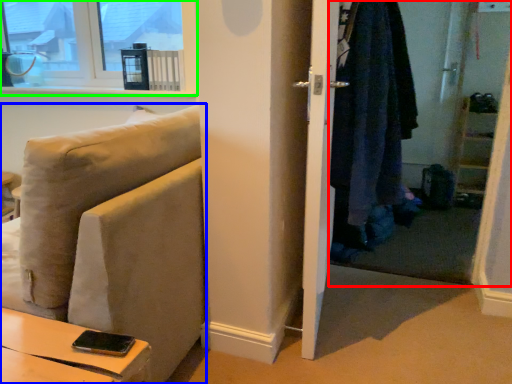
Question: Which object is positioned closest to closet (highlighted by a red box)? Select from studio couch (highlighted by a blue box) and window (highlighted by a green box).

Choices:
 (A) studio couch
 (B) window

Answer: (A)